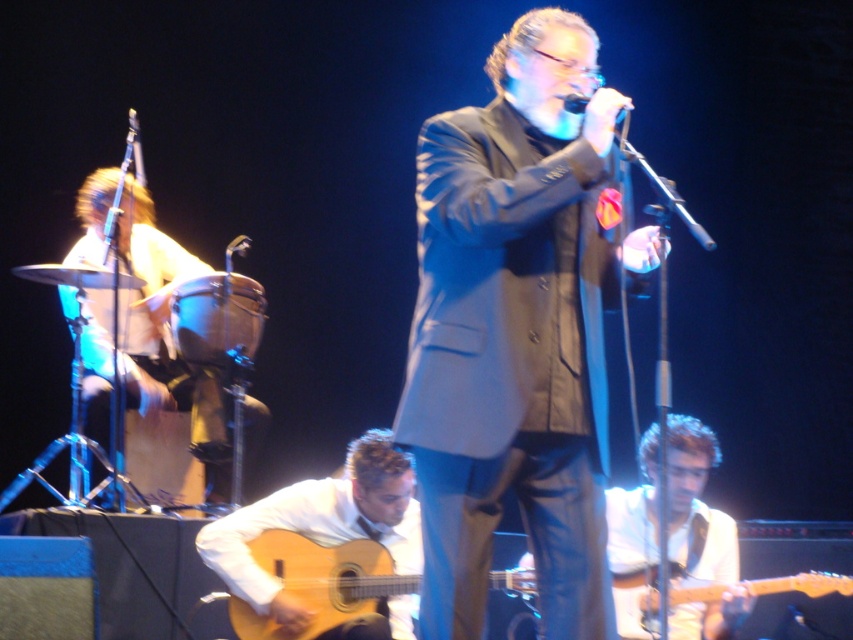
Which is behind, point (389, 609) or point (247, 243)?

Point (247, 243)

Is light brown wood guitar at center bigger than metallic silver microphone at upper center?

Yes.

Find the location of a particular element. light brown wood guitar at center is located at coordinates (320, 524).

Does black matte suit at center come behind light brown drum at left?

No, black matte suit at center is in front of light brown drum at left.

Can you confirm if black matte suit at center is taller than light brown drum at left?

Yes.

Describe the element at coordinates (514, 333) in the screenshot. I see `black matte suit at center` at that location.

The height and width of the screenshot is (640, 853). In order to click on black matte suit at center in this screenshot , I will do `click(514, 333)`.

Is point (584, 106) positioned before point (245, 253)?

Yes, it is in front of point (245, 253).

The image size is (853, 640). I want to click on black matte microphone at center, so click(x=575, y=102).

Which is in front, point (621, 113) or point (231, 256)?

Point (621, 113) is more forward.

Where is `black matte microphone at center`? Image resolution: width=853 pixels, height=640 pixels. black matte microphone at center is located at coordinates (575, 102).